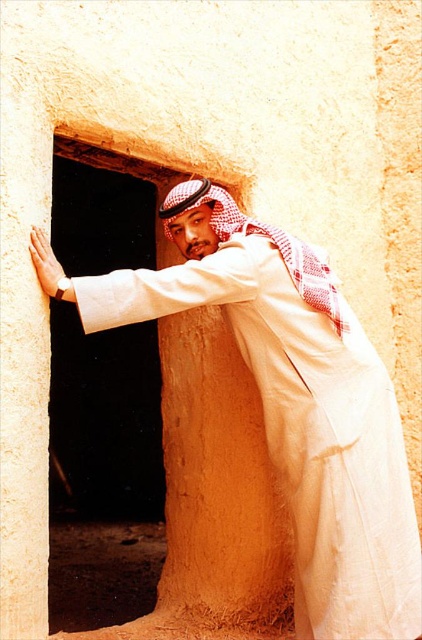
You are a photographer standing at the entrance of a traditional mud brick building. You want to take a photo of the man dressed in traditional attire who is leaning against the doorway. The camera you are using has a focal length of 50mm and an aperture of f2.8. The point you need to focus on is point (216, 188). What is the hyperfocal distance required to ensure the entire scene is in focus?

The hyperfocal distance can be calculated using the formula H 1 2 3 4 5 6 7 8 9 10 11 12 13 14 15 16 17 18 19 20 21 22 23 24 25 26 27 28 29 30 31 32 33 34 35 36 37 38 39 40 41 42 43 44 45 46 47 48 49 50 51 52 53 54 55 56 57 58 59 60 61 62 63 64 65 66 67 68 69 70 71 72 73 74 75 76 77 78 79 80 81 82 83 84 85 86 87 88 89 90 91 92 93 94 95 96 97 98 99 100 101 102 103 104 105 106 107 108 109 110 111 112 113 114 115 116 117 118 119 120 121 122 123 124 125 126 127 128 129 130 131 132 133 134 135 136 137 138 139 14

You are a photographer trying to capture the scene. The white cotton robe at center and the matte beige stone wall at center are both in your viewfinder. According to the scene, which object is located to the right of the other?

The white cotton robe at center is positioned on the right side of matte beige stone wall at center.